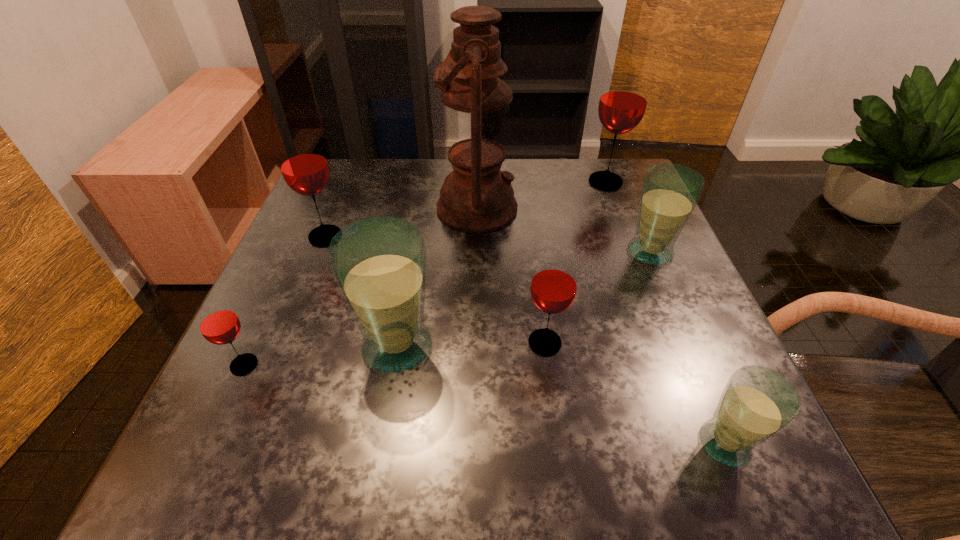
Identify the location of free region at the far right corner. This screenshot has height=540, width=960. (628, 206).

You are a GUI agent. You are given a task and a screenshot of the screen. Output one action in this format:
    pyautogui.click(x=<x>, y=<y>)
    Task: Click on the free point at the near right corner
    Image resolution: width=960 pixels, height=540 pixels.
    Given the screenshot: What is the action you would take?
    pyautogui.click(x=665, y=446)

Locate an element on the screen. The height and width of the screenshot is (540, 960). unoccupied area between the fourth glass from right to left and the third smallest red glass is located at coordinates (435, 289).

Where is `vacant space that's between the fourth glass from left to right and the farthest blue glass`? vacant space that's between the fourth glass from left to right and the farthest blue glass is located at coordinates (597, 298).

Identify the location of free spot between the biggest blue glass and the rightmost red glass. This screenshot has height=540, width=960. (501, 264).

Where is `vacant area between the nearest glass and the rightmost red glass`? The height and width of the screenshot is (540, 960). vacant area between the nearest glass and the rightmost red glass is located at coordinates (665, 313).

This screenshot has height=540, width=960. What are the coordinates of `unoccupied area between the farthest blue glass and the third biggest red glass` in the screenshot? It's located at (597, 298).

The width and height of the screenshot is (960, 540). I want to click on free space between the nearest glass and the second biggest blue glass, so click(687, 348).

This screenshot has width=960, height=540. Find the location of `vacant space that's between the second biggest red glass and the second biggest blue glass`. vacant space that's between the second biggest red glass and the second biggest blue glass is located at coordinates (488, 244).

At what (x,y) coordinates should I click in order to perform the action: click on free space between the fourth glass from left to right and the biggest blue glass. Please return your answer as a coordinate pair (x, y). The image size is (960, 540). Looking at the image, I should click on (471, 345).